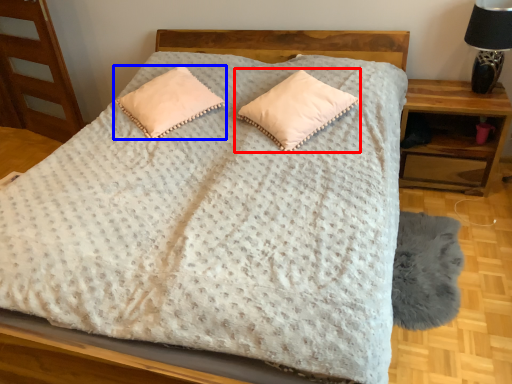
Question: Which object is further to the camera taking this photo, pillow (highlighted by a red box) or pillow (highlighted by a blue box)?

Choices:
 (A) pillow
 (B) pillow

Answer: (B)